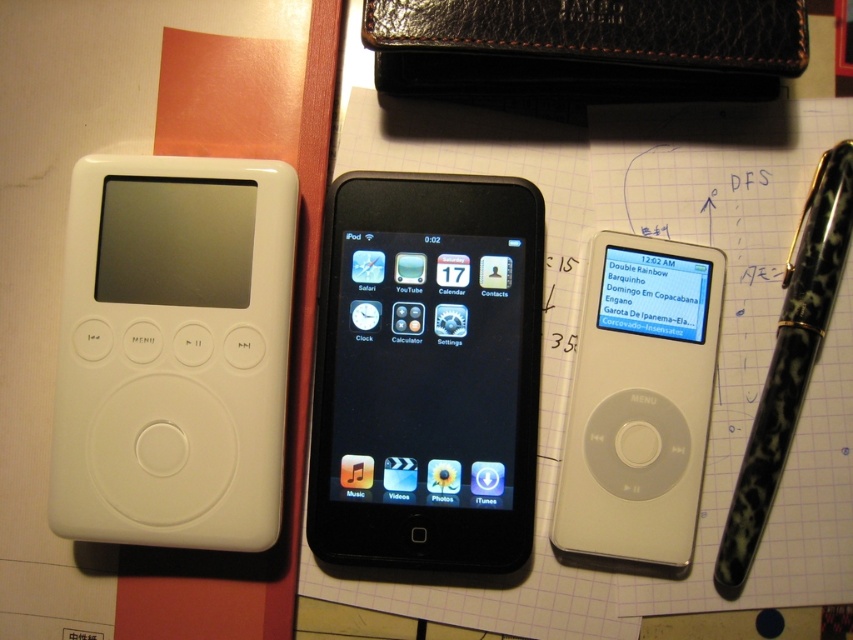
You are a GUI agent. You are given a task and a screenshot of the screen. Output one action in this format:
    pyautogui.click(x=<x>, y=<y>)
    Task: Click on the black glossy tablet at center
    
    Given the screenshot: What is the action you would take?
    pyautogui.click(x=427, y=372)

Who is more forward, (471,193) or (596,433)?

Point (596,433) is more forward.

Image resolution: width=853 pixels, height=640 pixels. Describe the element at coordinates (427, 372) in the screenshot. I see `black glossy tablet at center` at that location.

Where is `black glossy tablet at center`? Image resolution: width=853 pixels, height=640 pixels. black glossy tablet at center is located at coordinates (427, 372).

Can you confirm if white matte ipod at left is positioned below black marbled pen at right?

Actually, white matte ipod at left is above black marbled pen at right.

Based on the photo, who is more forward, [137,492] or [813,220]?

Positioned in front is point [137,492].

The height and width of the screenshot is (640, 853). I want to click on white matte ipod at left, so click(x=173, y=353).

From the picture: Between white matte ipod at center and black marbled pen at right, which one is positioned lower?

white matte ipod at center is below.

Which is in front, point (566, 552) or point (753, 534)?

Point (753, 534) is more forward.

Describe the element at coordinates (639, 401) in the screenshot. I see `white matte ipod at center` at that location.

At what (x,y) coordinates should I click in order to perform the action: click on white matte ipod at center. Please return your answer as a coordinate pair (x, y). Looking at the image, I should click on 639,401.